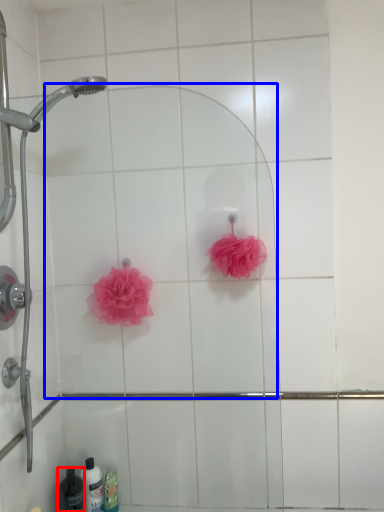
Question: Which object is closer to the camera taking this photo, toiletry (highlighted by a red box) or mirror (highlighted by a blue box)?

Choices:
 (A) toiletry
 (B) mirror

Answer: (B)